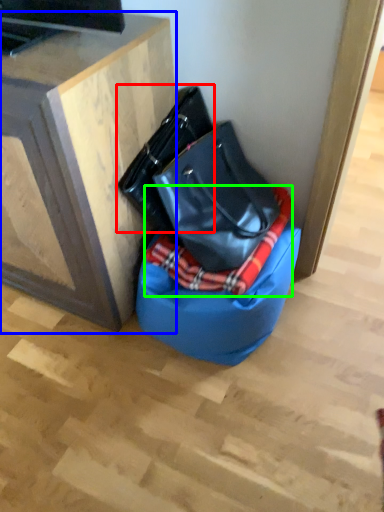
Question: Which object is the farthest from handbag (highlighted by a red box)? Choose among these: furniture (highlighted by a blue box) or blanket (highlighted by a green box).

Choices:
 (A) furniture
 (B) blanket

Answer: (B)